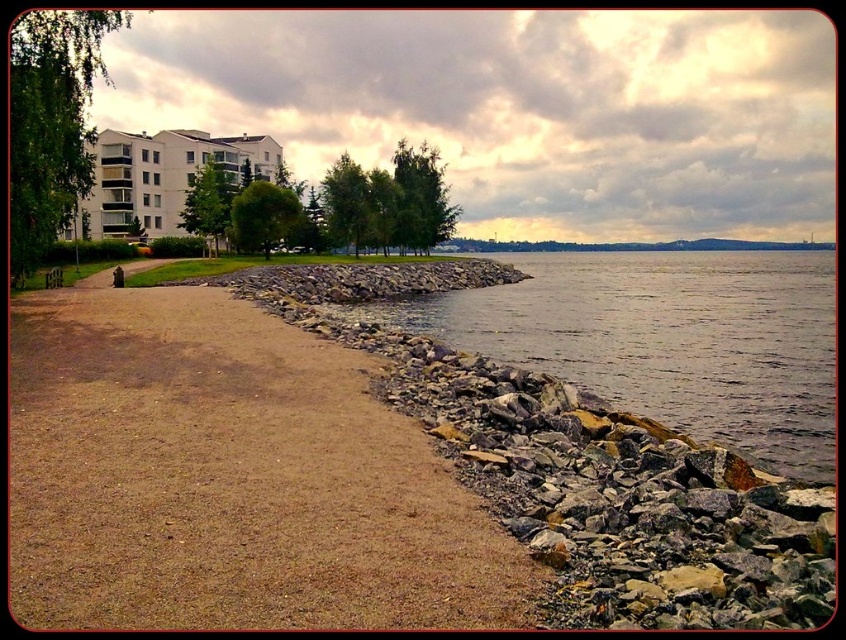
Looking at this image, you are a hiker who wants to cross from the brown gravel path at lower left to the grayish water at lower right. Since the path is smaller, can you walk directly from the path to the water without stepping on the rocks?

The brown gravel path at lower left has a smaller size compared to grayish water at lower right, so yes, you can walk directly from the brown gravel path at lower left to the grayish water at lower right without needing to step on the rocks.

You are standing at the center of the image and want to walk to the grayish water at lower right. Which direction should you move relative to the brown gravel path at lower left?

You should move to the right of the brown gravel path at lower left to reach the grayish water at lower right because the brown gravel path at lower left is to the left of grayish water at lower right.

You are standing at the point marked by the coordinates point [229,477], which is the brown gravel path at lower left. You want to walk towards the rocky embankment. Which direction should you move?

The point [229,477] is the brown gravel path at lower left. To reach the rocky embankment, you should move towards the right side of the frame as the embankment borders the path on that side.